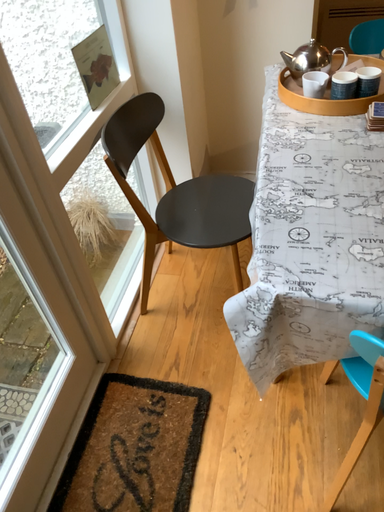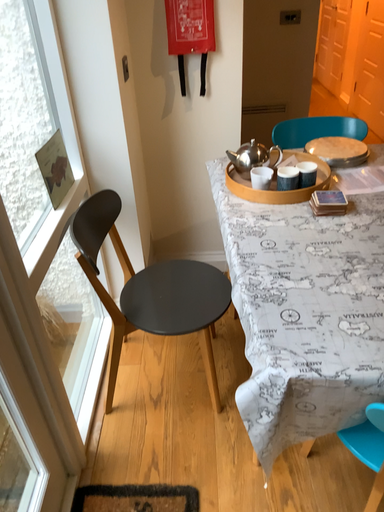
Question: Which way did the camera rotate in the video?

Choices:
 (A) rotated right
 (B) rotated left

Answer: (A)